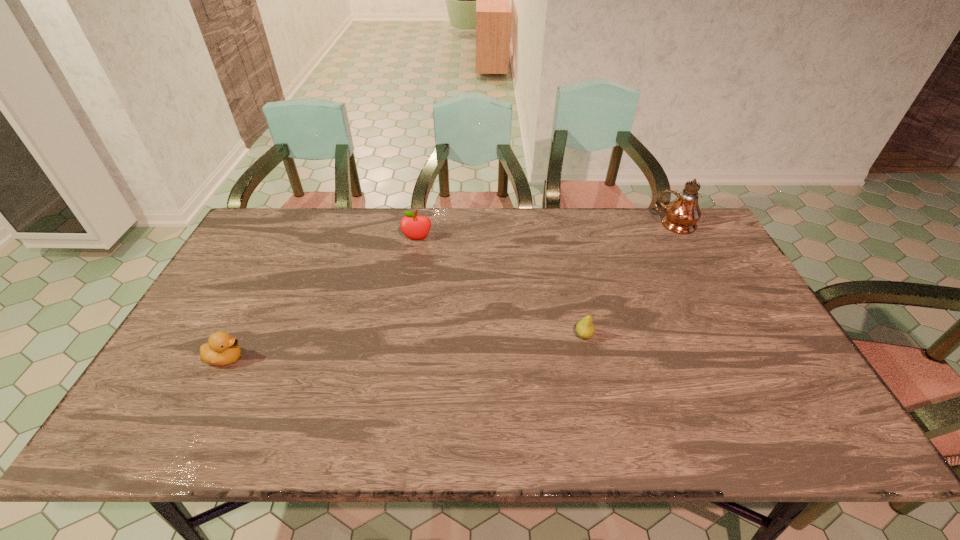
This screenshot has width=960, height=540. I want to click on free spot located on the back of the second nearest object, so click(x=564, y=247).

The image size is (960, 540). What are the coordinates of `vacant space located facing forward on the leftmost object` in the screenshot? It's located at (313, 358).

This screenshot has height=540, width=960. Identify the location of oil lamp that is at the far edge. (682, 214).

This screenshot has width=960, height=540. What are the coordinates of `apple at the far edge` in the screenshot? It's located at (413, 226).

I want to click on object positioned at the left edge, so click(x=222, y=349).

You are a GUI agent. You are given a task and a screenshot of the screen. Output one action in this format:
    pyautogui.click(x=<x>, y=<y>)
    Task: Click on the object located in the right edge section of the desktop
    
    Given the screenshot: What is the action you would take?
    pyautogui.click(x=682, y=214)

This screenshot has width=960, height=540. I want to click on object that is at the far right corner, so click(x=682, y=214).

I want to click on vacant space at the far edge of the desktop, so coord(576,248).

Find the location of a particular element. This screenshot has width=960, height=540. vacant space at the near edge of the desktop is located at coordinates (592, 422).

In the image, there is a desktop. Where is `blank space at the left edge`? blank space at the left edge is located at coordinates (222, 285).